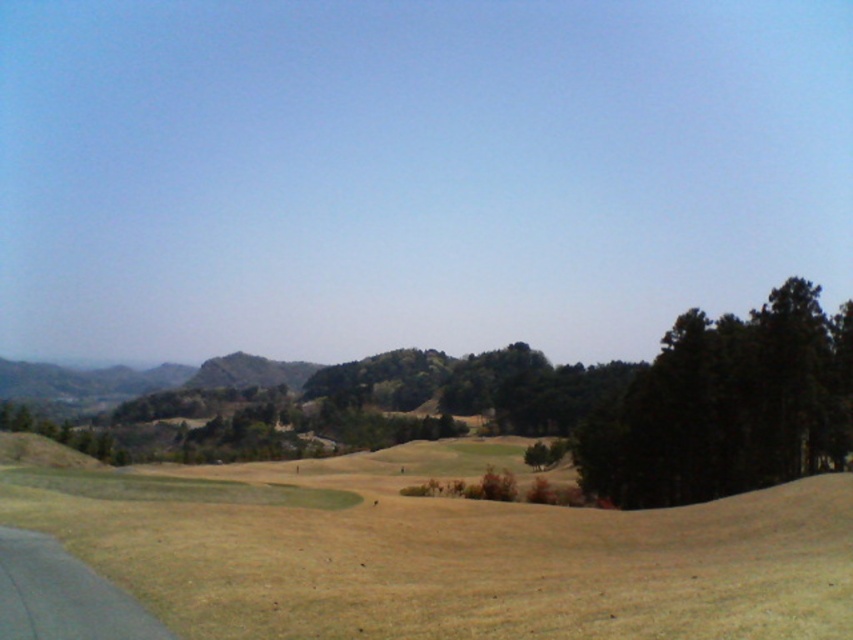
Does green grassy field at center have a larger size compared to dark green textured trees at right?

Indeed, green grassy field at center has a larger size compared to dark green textured trees at right.

Can you confirm if green grassy field at center is positioned to the right of dark green textured trees at right?

Answer: Incorrect, green grassy field at center is not on the right side of dark green textured trees at right.

At what (x,y) coordinates should I click in order to perform the action: click on green grassy field at center. Please return your answer as a coordinate pair (x, y). The height and width of the screenshot is (640, 853). Looking at the image, I should click on (445, 552).